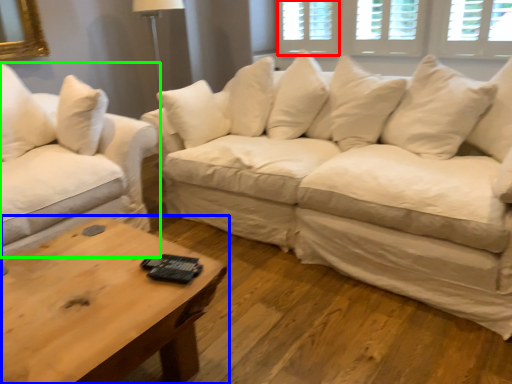
Question: Considering the real-world distances, which object is farthest from window (highlighted by a red box)? coffee table (highlighted by a blue box) or studio couch (highlighted by a green box)?

Choices:
 (A) coffee table
 (B) studio couch

Answer: (A)